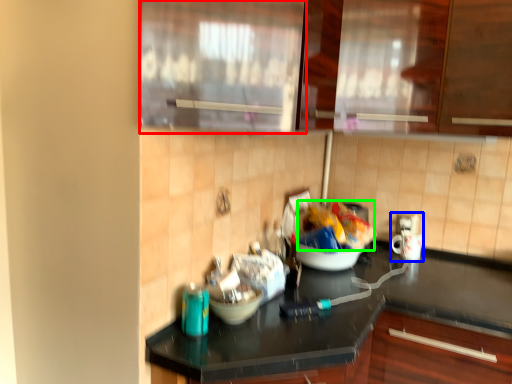
Question: Estimate the real-world distances between objects in this image. Which object is farther from glass door (highlighted by a red box), appliance (highlighted by a blue box) or food (highlighted by a green box)?

Choices:
 (A) appliance
 (B) food

Answer: (A)